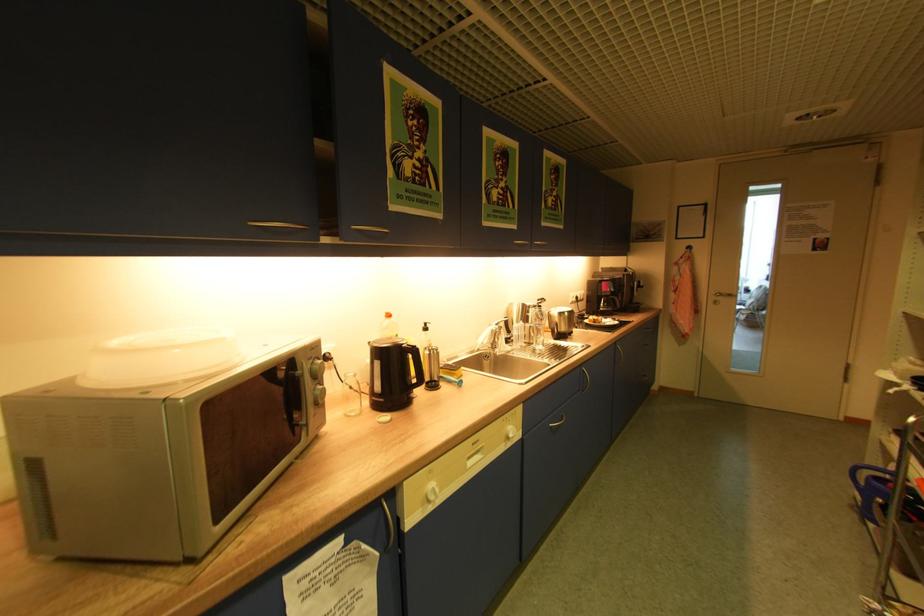
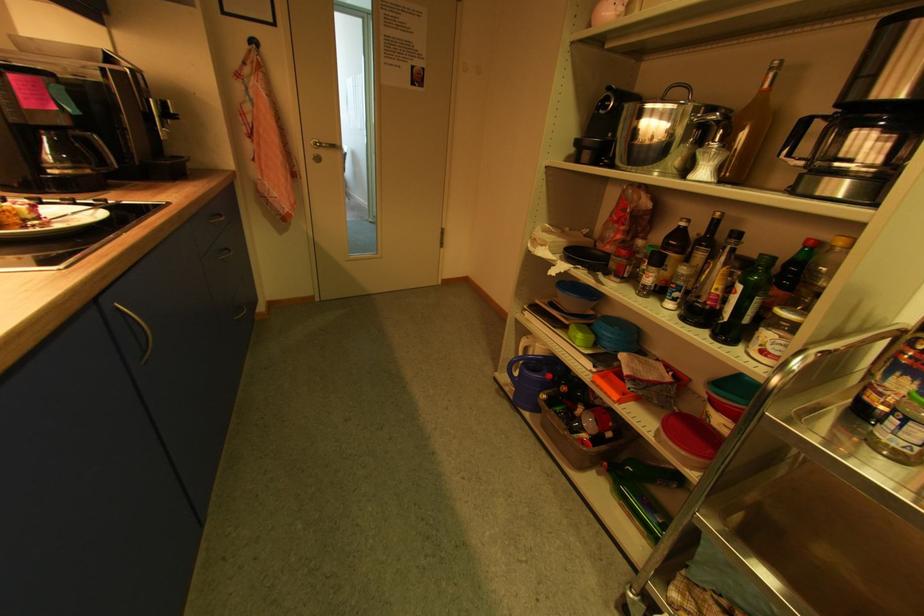
Find the pixel in the second image that matches (868,484) in the first image.

(521, 375)